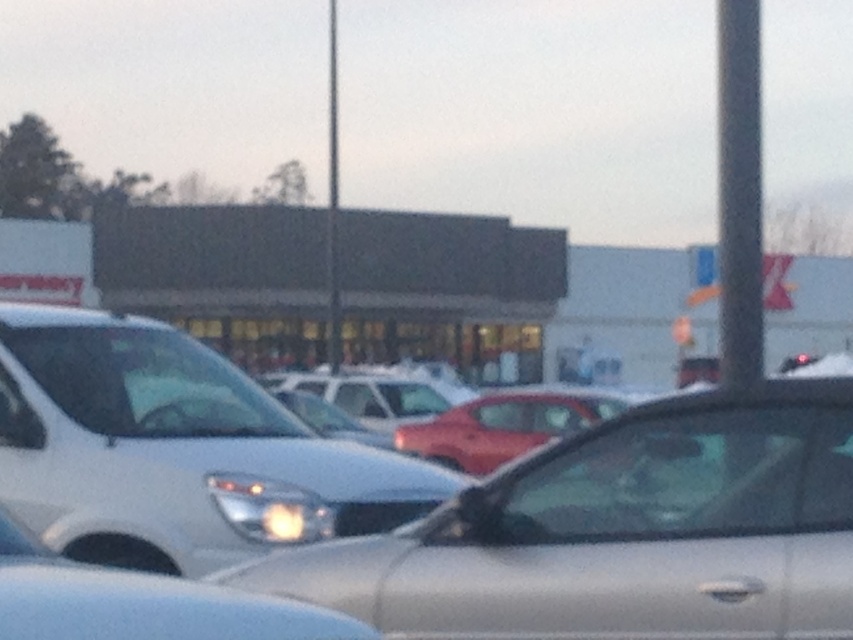
Question: Can you confirm if satin silver car at center is positioned below white matte van at left?

Choices:
 (A) yes
 (B) no

Answer: (A)

Question: Considering the relative positions of satin silver car at center and white matte van at left in the image provided, where is satin silver car at center located with respect to white matte van at left?

Choices:
 (A) above
 (B) below

Answer: (B)

Question: Which point is closer to the camera taking this photo?

Choices:
 (A) (335, 524)
 (B) (645, 589)

Answer: (B)

Question: Does satin silver car at center have a greater width compared to white matte van at left?

Choices:
 (A) no
 (B) yes

Answer: (A)